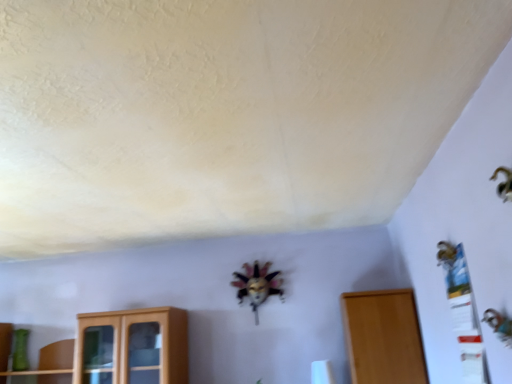
What do you see at coordinates (383, 337) in the screenshot? I see `light wood cabinet at center` at bounding box center [383, 337].

You are a GUI agent. You are given a task and a screenshot of the screen. Output one action in this format:
    pyautogui.click(x=<x>, y=<y>)
    Task: Click on the light wood cabinet at center
    This screenshot has width=512, height=384.
    Given the screenshot: What is the action you would take?
    pyautogui.click(x=383, y=337)

The height and width of the screenshot is (384, 512). I want to click on light wood cabinet at center, so click(383, 337).